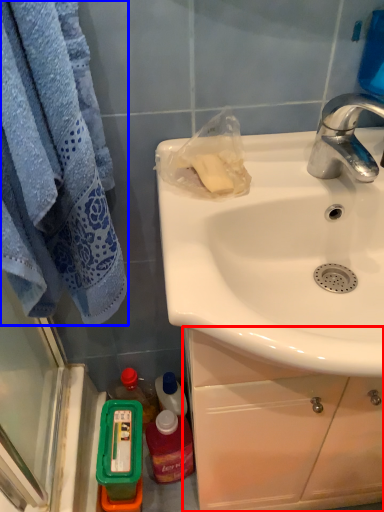
Question: Which point is closer to the camera, cabinetry (highlighted by a red box) or towel/napkin (highlighted by a blue box)?

Choices:
 (A) cabinetry
 (B) towel/napkin

Answer: (B)